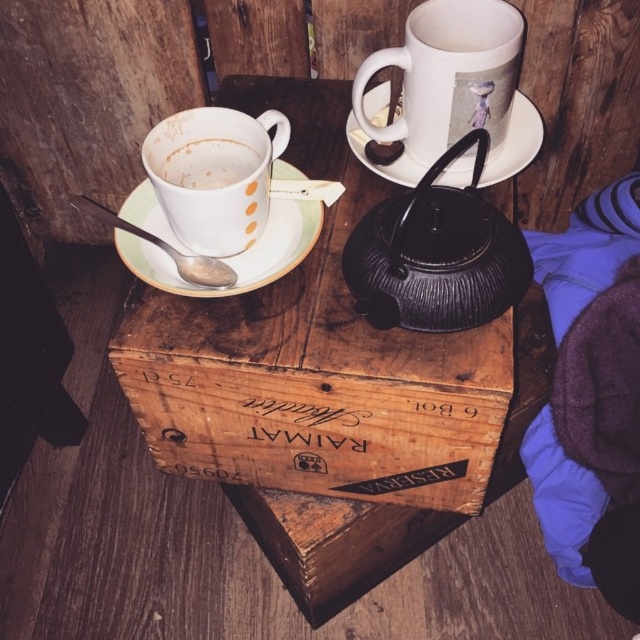
Question: Observing the image, what is the correct spatial positioning of wooden crate at center in reference to matte white cup at left?

Choices:
 (A) below
 (B) above

Answer: (A)

Question: Does white ceramic saucer at upper center appear under white matte cup at upper left?

Choices:
 (A) yes
 (B) no

Answer: (B)

Question: Does white ceramic mug at upper center appear on the left side of white ceramic saucer at upper center?

Choices:
 (A) yes
 (B) no

Answer: (B)

Question: Based on their relative distances, which object is nearer to the white ceramic saucer at upper left?

Choices:
 (A) matte white cup at left
 (B) white matte cup at upper left

Answer: (A)

Question: Which point is closer to the camera?

Choices:
 (A) (396, 276)
 (B) (156, 188)
 (C) (237, 170)

Answer: (A)

Question: Which point appears closest to the camera in this image?

Choices:
 (A) (266, 272)
 (B) (196, 188)
 (C) (460, 296)
 (D) (461, 128)

Answer: (C)